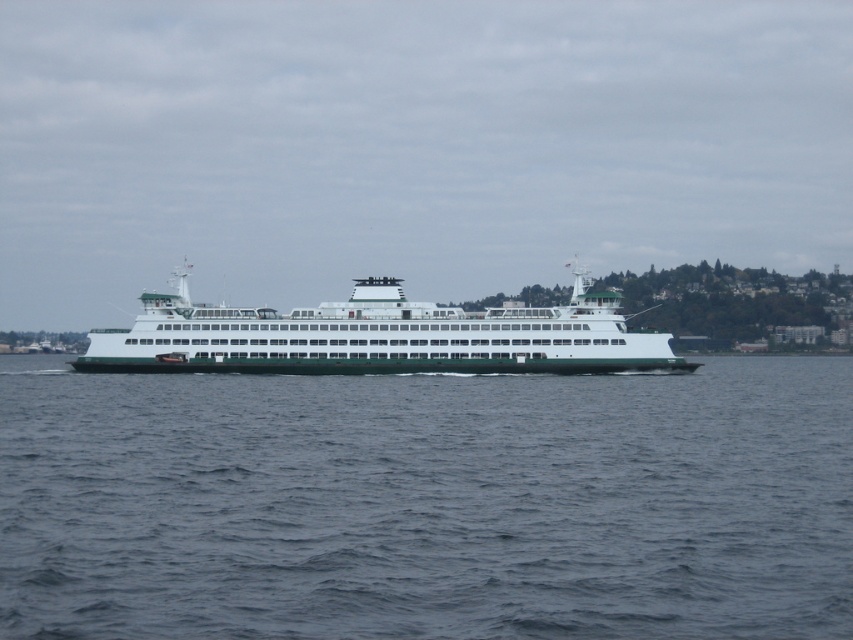
You are standing on the ferry boat and looking out. You see the point marked at coordinates (427, 502). What is located at that point?

The point at coordinates (427, 502) marks blue water at center.

You are a passenger on the ferry and want to take a photo of the blue water at center and the green matte ferry at center. Which one should you zoom in on to capture both in the frame without moving your camera?

The blue water at center is smaller than the green matte ferry at center, so you should zoom in on the green matte ferry at center to ensure both fit in the frame.